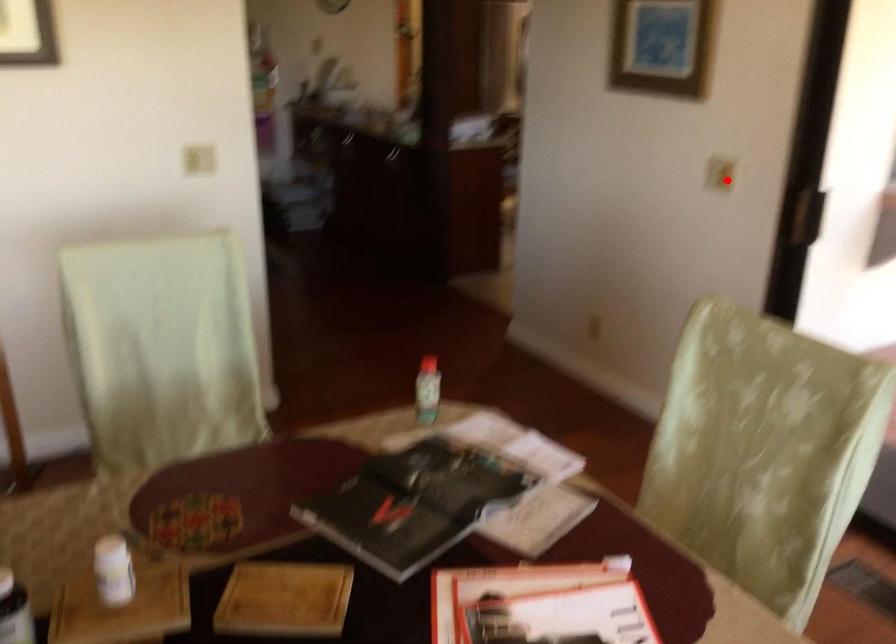
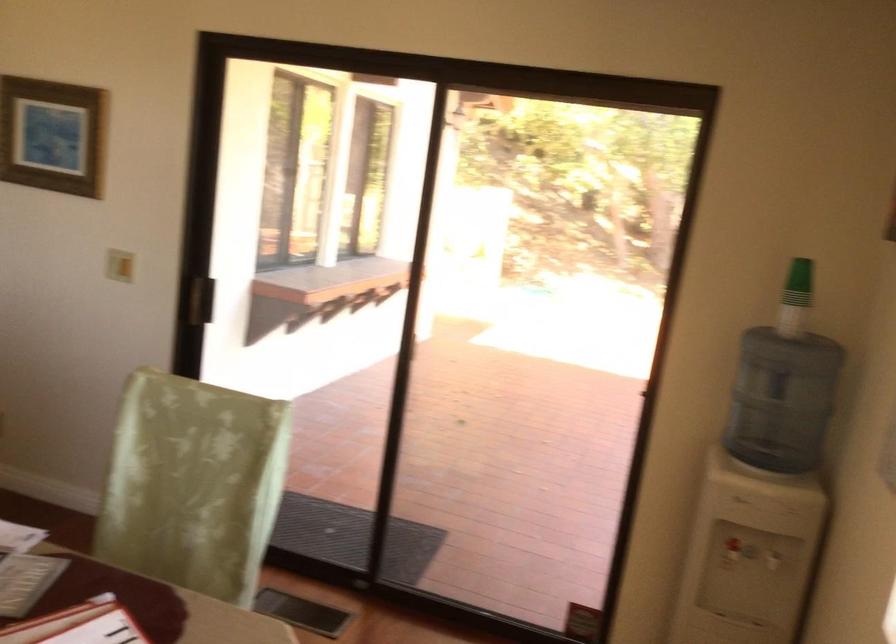
Question: I am providing you with two images of the same scene from different viewpoints. A red point is shown in image1. For the corresponding object point in image2, is it positioned nearer or farther from the camera?

Choices:
 (A) Nearer
 (B) Farther

Answer: (B)